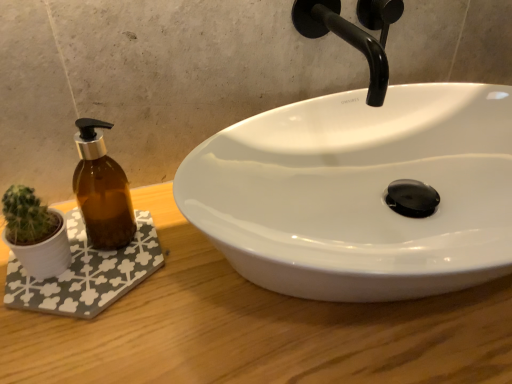
Find the location of `vacant area that lies between white glossy sink at center and white fabric bath mat at lower left`. vacant area that lies between white glossy sink at center and white fabric bath mat at lower left is located at coordinates (134, 313).